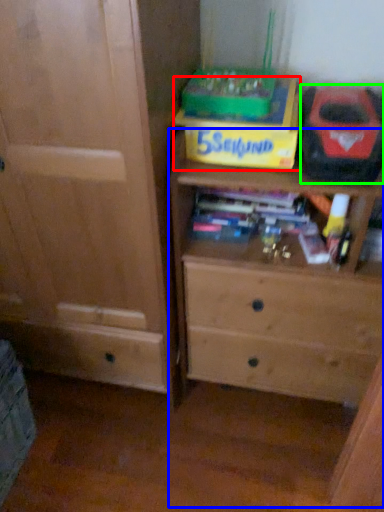
Question: Which is nearer to the cardboard box (highlighted by a red box)? chest of drawers (highlighted by a blue box) or kit (highlighted by a green box).

Choices:
 (A) chest of drawers
 (B) kit

Answer: (B)